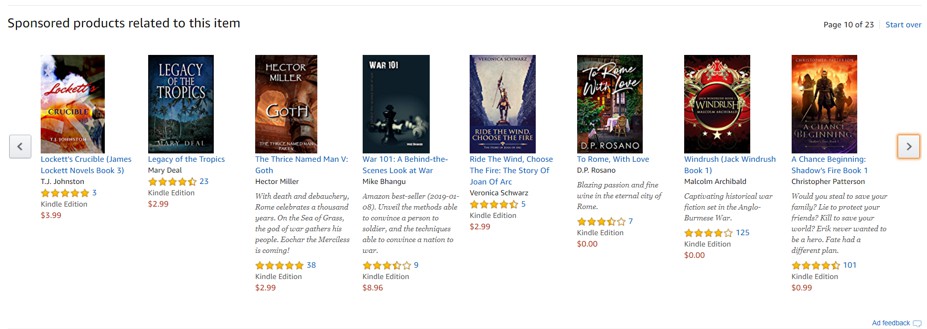
At what (x,y) coordinates should I click in order to perform the action: click on book. Please return your answer as a coordinate pair (x, y). Looking at the image, I should click on (79, 87), (197, 82), (269, 95), (374, 87), (513, 102), (611, 95), (710, 106), (822, 104).